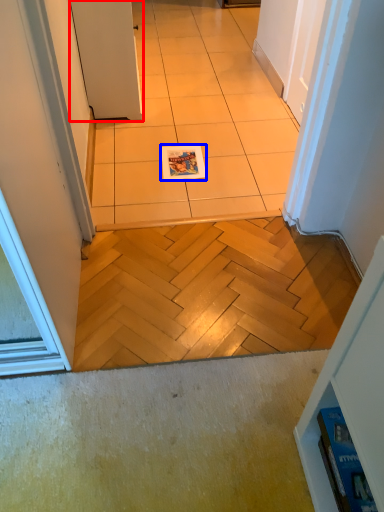
Question: Which point is closer to the camera, door (highlighted by a red box) or magazine (highlighted by a blue box)?

Choices:
 (A) door
 (B) magazine

Answer: (A)